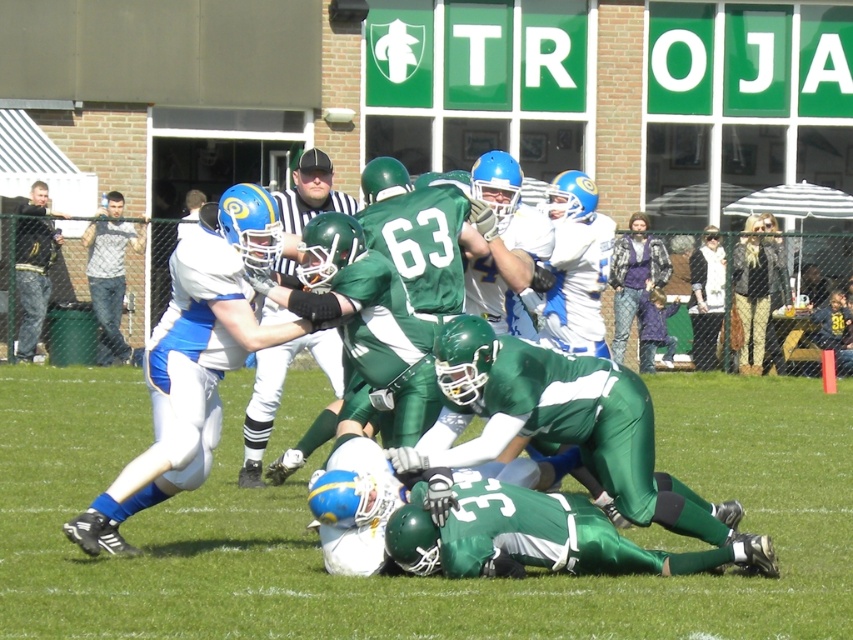
You are a quarterback in the white team. You need to pass the ball to your teammate located at point [506,548]. However, there is an opponent player at point [119,280]. Will the opponent player be blocking your pass to your teammate?

Point [506,548] is in front of point [119,280], so the opponent player at point [119,280] will not block your pass to your teammate at point [506,548] because the teammate is positioned in front of the opponent.